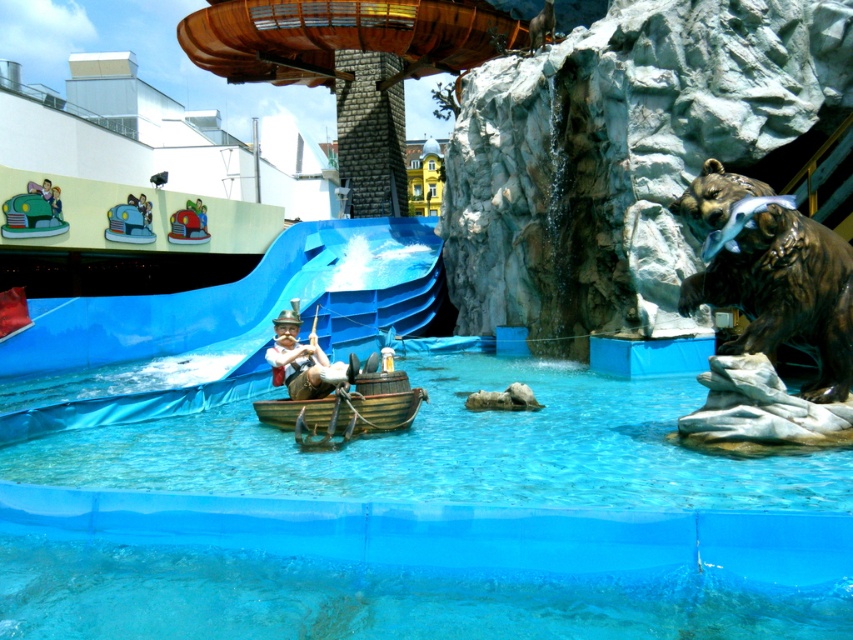
Question: Does blue plastic slide at center have a lesser width compared to bronze bear at right?

Choices:
 (A) no
 (B) yes

Answer: (A)

Question: Which of the following is the closest to the observer?

Choices:
 (A) bronze bear at right
 (B) metallic red car at upper left

Answer: (A)

Question: Is blue plastic slide at center smaller than bronze bear at right?

Choices:
 (A) no
 (B) yes

Answer: (A)

Question: Which point is farther to the camera?

Choices:
 (A) transparent plastic pool at center
 (B) metallic red car at upper left
 (C) wooden raft at center
 (D) blue plastic slide at center

Answer: (B)

Question: Which of the following is the farthest from the observer?

Choices:
 (A) metallic car at left
 (B) metallic red car at upper left

Answer: (B)

Question: Is blue plastic slide at center above metallic car at left?

Choices:
 (A) no
 (B) yes

Answer: (A)